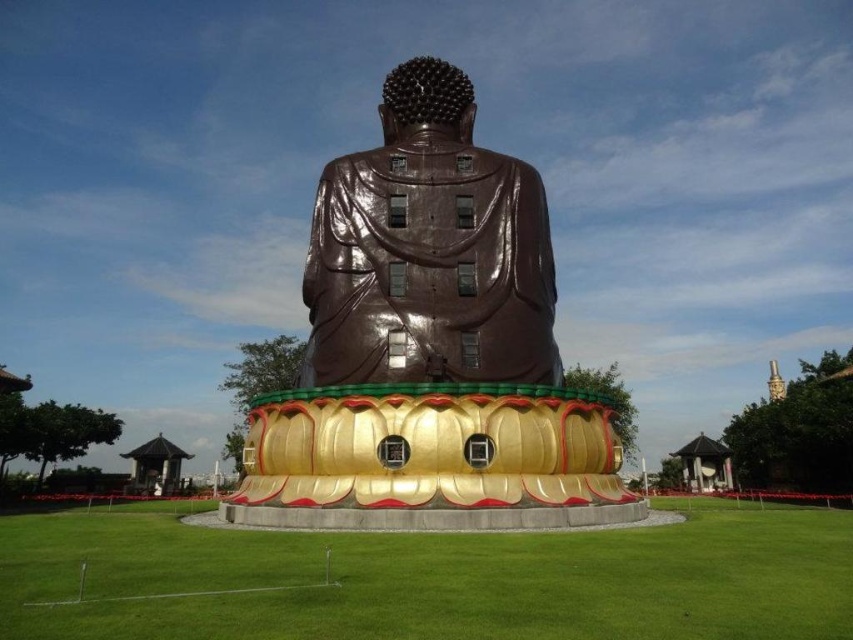
Question: Can you confirm if bronze statue at center is positioned to the left of shiny bronze statue at center?

Choices:
 (A) no
 (B) yes

Answer: (B)

Question: Which point appears closest to the camera in this image?

Choices:
 (A) (334, 275)
 (B) (318, 307)

Answer: (A)

Question: Does bronze statue at center have a smaller size compared to shiny bronze statue at center?

Choices:
 (A) no
 (B) yes

Answer: (A)

Question: Is bronze statue at center below shiny bronze statue at center?

Choices:
 (A) no
 (B) yes

Answer: (B)

Question: Which of the following is the closest to the observer?

Choices:
 (A) bronze statue at center
 (B) shiny bronze statue at center

Answer: (A)

Question: Which point appears closest to the camera in this image?

Choices:
 (A) (364, 392)
 (B) (311, 268)

Answer: (A)